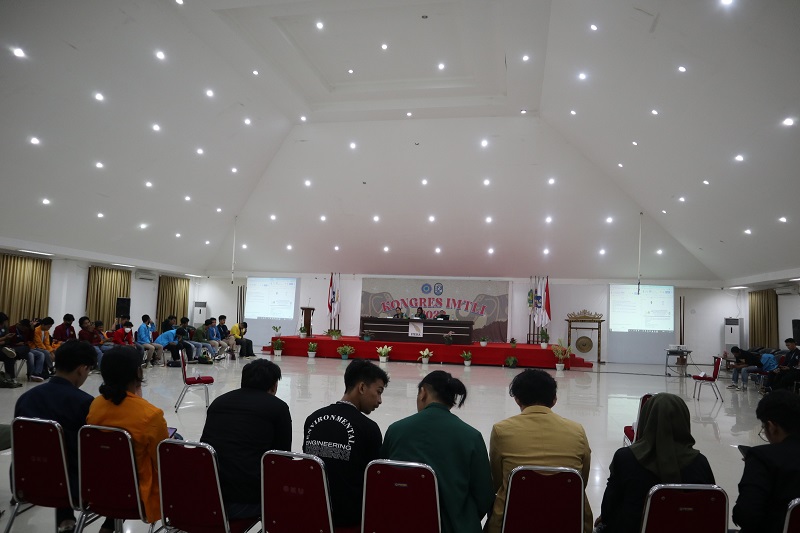
Where is `chairbacks`? chairbacks is located at coordinates (560, 492), (669, 500), (400, 512), (313, 499), (177, 492), (118, 479), (38, 469).